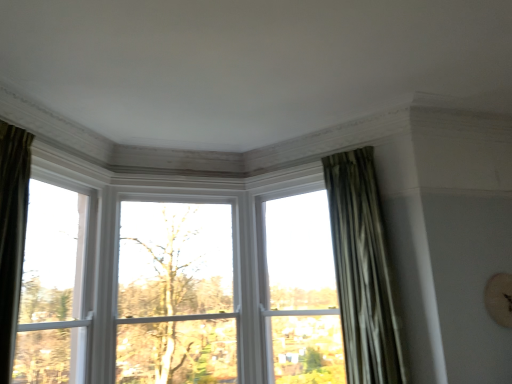
Measure the distance between green leafy tree at center and camera.

A distance of 3.25 meters exists between green leafy tree at center and camera.

What is the approximate width of silky green curtain at right?

silky green curtain at right is 11.18 inches wide.

Find the location of a particular element. Image resolution: width=512 pixels, height=384 pixels. white wood window at left, which ranks as the first window in left-to-right order is located at coordinates (52, 287).

Can you confirm if white wood window at left, which ranks as the first window in left-to-right order, is smaller than green leafy tree at center?

Correct, white wood window at left, which ranks as the first window in left-to-right order, occupies less space than green leafy tree at center.

Is white wood window at left, which ranks as the first window in left-to-right order, situated inside green leafy tree at center or outside?

white wood window at left, which ranks as the first window in left-to-right order, cannot be found inside green leafy tree at center.

Considering the sizes of white wood window at left, which ranks as the first window in left-to-right order, and green leafy tree at center in the image, is white wood window at left, which ranks as the first window in left-to-right order, taller or shorter than green leafy tree at center?

Considering their sizes, white wood window at left, which ranks as the first window in left-to-right order, has less height than green leafy tree at center.

Is point (344, 158) closer or farther from the camera than point (160, 328)?

Clearly, point (344, 158) is closer to the camera than point (160, 328).

From the image's perspective, is silky green curtain at right over green leafy tree at center?

Yes, from the image's perspective, silky green curtain at right is on top of green leafy tree at center.

Which is behind, silky green curtain at right or green leafy tree at center?

green leafy tree at center is more distant.

Based on their sizes in the image, would you say silky green curtain at right is bigger or smaller than green leafy tree at center?

silky green curtain at right is smaller than green leafy tree at center.

Between clear glass window at center, the 1th window positioned from the right, and green leafy tree at center, which one has larger size?

Bigger between the two is clear glass window at center, the 1th window positioned from the right.

Which object is thinner, clear glass window at center, arranged as the second window when viewed from the left, or green leafy tree at center?

green leafy tree at center.

Are clear glass window at center, the 1th window positioned from the right, and green leafy tree at center far apart?

They are positioned close to each other.

From a real-world perspective, which is physically below, clear glass window at center, arranged as the second window when viewed from the left, or green leafy tree at center?

clear glass window at center, arranged as the second window when viewed from the left, is physically lower.

Does point (327, 190) appear closer or farther from the camera than point (326, 283)?

Point (327, 190) is positioned closer to the camera compared to point (326, 283).

Between silky green curtain at right and clear glass window at center, the 1th window positioned from the right, which one appears on the right side from the viewer's perspective?

silky green curtain at right is more to the right.

Is silky green curtain at right situated inside clear glass window at center, the 1th window positioned from the right, or outside?

silky green curtain at right exists outside the volume of clear glass window at center, the 1th window positioned from the right.

Is silky green curtain at right aimed at clear glass window at center, the 1th window positioned from the right?

No, silky green curtain at right is not oriented towards clear glass window at center, the 1th window positioned from the right.

Does point (194, 288) come behind point (80, 259)?

That is True.

Is green leafy tree at center not close to white wood window at left, which is the 2th window from right to left?

No.

Would you say green leafy tree at center contains white wood window at left, which is the 2th window from right to left?

No, white wood window at left, which is the 2th window from right to left, is not a part of green leafy tree at center.

Considering the relative positions of green leafy tree at center and white wood window at left, which is the 2th window from right to left, in the image provided, is green leafy tree at center in front of white wood window at left, which is the 2th window from right to left,?

No, green leafy tree at center is further to the viewer.

Between green leafy tree at center and silky green curtain at right, which one has smaller width?

green leafy tree at center.

Is point (135, 360) positioned in front of point (339, 297)?

No, it is behind (339, 297).

Considering the relative sizes of green leafy tree at center and silky green curtain at right in the image provided, is green leafy tree at center bigger than silky green curtain at right?

Indeed, green leafy tree at center has a larger size compared to silky green curtain at right.

Could you tell me if green leafy tree at center is turned towards silky green curtain at right?

No.

Considering the positions of objects white wood window at left, which ranks as the first window in left-to-right order, and clear glass window at center, the 1th window positioned from the right, in the image provided, who is more to the left, white wood window at left, which ranks as the first window in left-to-right order, or clear glass window at center, the 1th window positioned from the right,?

white wood window at left, which ranks as the first window in left-to-right order.

How many degrees apart are the facing directions of white wood window at left, which ranks as the first window in left-to-right order, and clear glass window at center, the 1th window positioned from the right?

white wood window at left, which ranks as the first window in left-to-right order, and clear glass window at center, the 1th window positioned from the right, are facing 108 degrees away from each other.

Which object is closer to the camera taking this photo, white wood window at left, which ranks as the first window in left-to-right order, or clear glass window at center, arranged as the second window when viewed from the left?

Positioned in front is white wood window at left, which ranks as the first window in left-to-right order.

You are a GUI agent. You are given a task and a screenshot of the screen. Output one action in this format:
    pyautogui.click(x=<x>, y=<y>)
    Task: Click on the window located above the clear glass window at center, arranged as the second window when viewed from the left (from the image's perspective)
    The width and height of the screenshot is (512, 384).
    Given the screenshot: What is the action you would take?
    pyautogui.click(x=52, y=287)

Where is `tree below the white wood window at left, which is the 2th window from right to left (from the image's perspective)`? tree below the white wood window at left, which is the 2th window from right to left (from the image's perspective) is located at coordinates (175, 294).

Where is `curtain on the right of green leafy tree at center`? This screenshot has height=384, width=512. curtain on the right of green leafy tree at center is located at coordinates (362, 271).

Looking at the image, which one is located further to green leafy tree at center, white wood window at left, which ranks as the first window in left-to-right order, or clear glass window at center, the 1th window positioned from the right?

clear glass window at center, the 1th window positioned from the right, is further to green leafy tree at center.

Looking at the image, which one is located further to clear glass window at center, the 1th window positioned from the right, white wood window at left, which is the 2th window from right to left, or silky green curtain at right?

white wood window at left, which is the 2th window from right to left, is further to clear glass window at center, the 1th window positioned from the right.

Looking at the image, which one is located further to white wood window at left, which ranks as the first window in left-to-right order, green leafy tree at center or silky green curtain at right?

Based on the image, silky green curtain at right appears to be further to white wood window at left, which ranks as the first window in left-to-right order.

Which object lies nearer to the anchor point green leafy tree at center, silky green curtain at right or clear glass window at center, arranged as the second window when viewed from the left?

clear glass window at center, arranged as the second window when viewed from the left, is closer to green leafy tree at center.

When comparing their distances from white wood window at left, which is the 2th window from right to left, does green leafy tree at center or clear glass window at center, arranged as the second window when viewed from the left, seem closer?

Answer: green leafy tree at center is positioned closer to the anchor white wood window at left, which is the 2th window from right to left.

Considering their positions, is silky green curtain at right positioned closer to clear glass window at center, arranged as the second window when viewed from the left, than white wood window at left, which is the 2th window from right to left?

The object closer to clear glass window at center, arranged as the second window when viewed from the left, is silky green curtain at right.

Considering their positions, is white wood window at left, which ranks as the first window in left-to-right order, positioned closer to green leafy tree at center than silky green curtain at right?

white wood window at left, which ranks as the first window in left-to-right order.

When comparing their distances from white wood window at left, which ranks as the first window in left-to-right order, does silky green curtain at right or green leafy tree at center seem further?

silky green curtain at right is further to white wood window at left, which ranks as the first window in left-to-right order.

Find the location of `window between white wood window at left, which is the 2th window from right to left, and silky green curtain at right, in the horizontal direction`. window between white wood window at left, which is the 2th window from right to left, and silky green curtain at right, in the horizontal direction is located at coordinates (302, 291).

Locate an element on the screen. Image resolution: width=512 pixels, height=384 pixels. tree between white wood window at left, which is the 2th window from right to left, and clear glass window at center, the 1th window positioned from the right, from left to right is located at coordinates (175, 294).

Locate an element on the screen. tree situated between white wood window at left, which is the 2th window from right to left, and silky green curtain at right from left to right is located at coordinates (175, 294).

This screenshot has width=512, height=384. What are the coordinates of `window between green leafy tree at center and silky green curtain at right in the horizontal direction` in the screenshot? It's located at (302, 291).